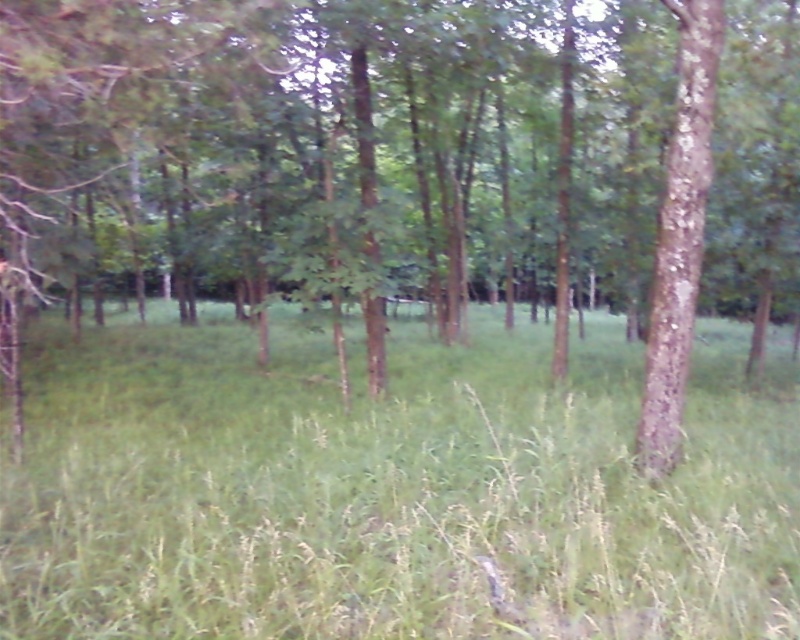
Who is more forward, (328, 582) or (686, 67)?

Point (328, 582) is in front.

Does point (726, 344) come behind point (690, 292)?

Yes, point (726, 344) is behind point (690, 292).

I want to click on green grassy at center, so click(393, 492).